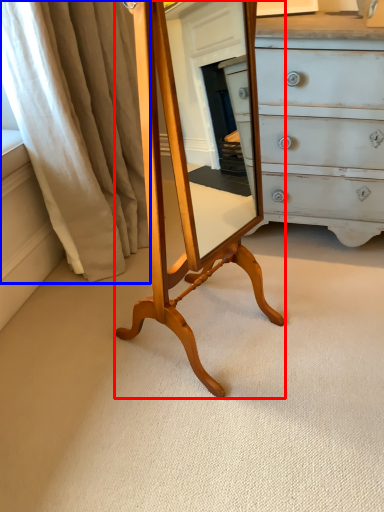
Question: Which point is closer to the camera, table (highlighted by a red box) or curtain (highlighted by a blue box)?

Choices:
 (A) table
 (B) curtain

Answer: (A)